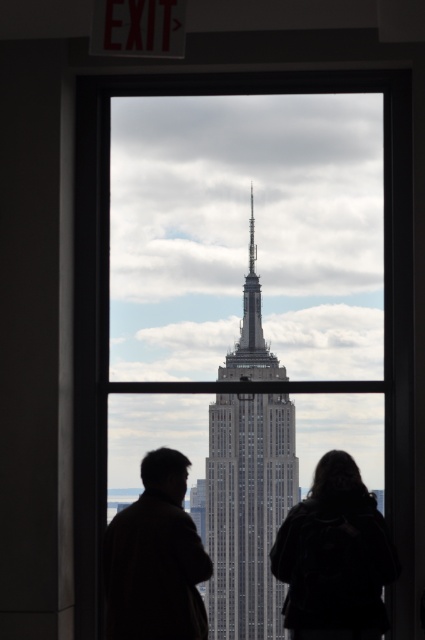
Which is more to the left, transparent glass window at center or white stone tower at center?

Positioned to the left is transparent glass window at center.

Is point (78, 179) closer to viewer compared to point (235, 556)?

Yes, point (78, 179) is in front of point (235, 556).

Does point (82, 144) come farther from viewer compared to point (246, 461)?

No, (82, 144) is closer to viewer.

Image resolution: width=425 pixels, height=640 pixels. Identify the location of transparent glass window at center. (107, 305).

Who is positioned more to the right, transparent glass window at center or black leather jacket at center?

black leather jacket at center is more to the right.

Describe the element at coordinates (107, 305) in the screenshot. I see `transparent glass window at center` at that location.

Is point (410, 320) behind point (342, 461)?

That is False.

You are a GUI agent. You are given a task and a screenshot of the screen. Output one action in this format:
    pyautogui.click(x=<x>, y=<y>)
    Task: Click on the transparent glass window at center
    Image resolution: width=425 pixels, height=640 pixels.
    Given the screenshot: What is the action you would take?
    pyautogui.click(x=107, y=305)

Does silhouette clothing at center have a lesser height compared to brown leather jacket at lower left?

In fact, silhouette clothing at center may be taller than brown leather jacket at lower left.

Which is more to the left, silhouette clothing at center or brown leather jacket at lower left?

brown leather jacket at lower left is more to the left.

Is point (351, 561) closer to viewer compared to point (127, 544)?

That is True.

The width and height of the screenshot is (425, 640). I want to click on silhouette clothing at center, so click(334, 557).